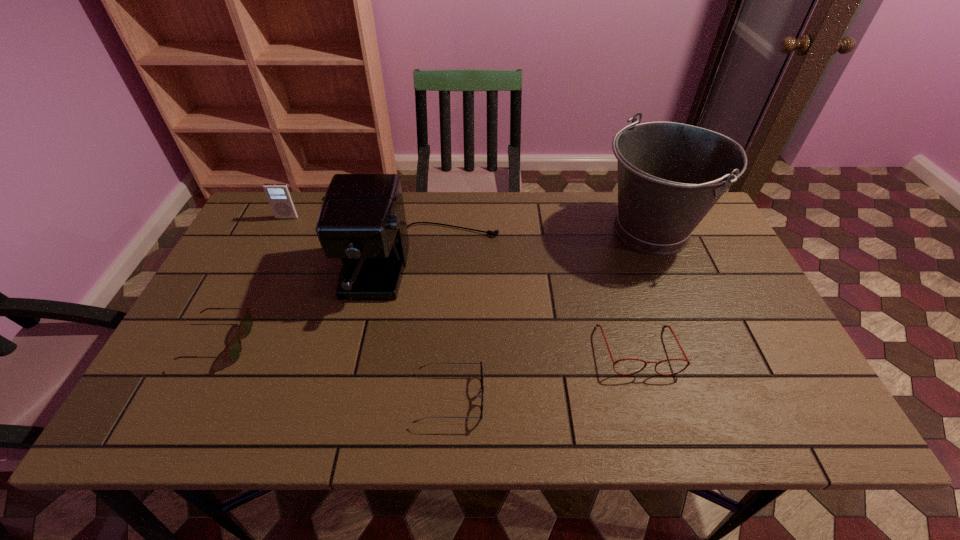
At what (x,y) coordinates should I click in order to perform the action: click on the tallest object. Please return your answer as a coordinate pair (x, y). Looking at the image, I should click on [x=670, y=175].

Identify the location of the fifth shortest object. (362, 220).

Image resolution: width=960 pixels, height=540 pixels. Identify the location of the fourth shortest object. tap(279, 196).

Find the location of a particular element. the rightmost spectacles is located at coordinates coord(688,363).

The image size is (960, 540). I want to click on the tallest spectacles, so click(x=688, y=363).

This screenshot has height=540, width=960. Identify the location of the leftmost spectacles. [x=233, y=352].

Locate an element on the screen. This screenshot has width=960, height=540. the second spectacles from right to left is located at coordinates (480, 396).

Find the location of `free region located 0.220m on the front of the bucket`. free region located 0.220m on the front of the bucket is located at coordinates (695, 334).

Where is `vacant space situated on the front-facing side of the coffee maker`? vacant space situated on the front-facing side of the coffee maker is located at coordinates click(407, 378).

Image resolution: width=960 pixels, height=540 pixels. In order to click on free region located on the front-facing side of the third tallest object in this screenshot , I will do `click(265, 264)`.